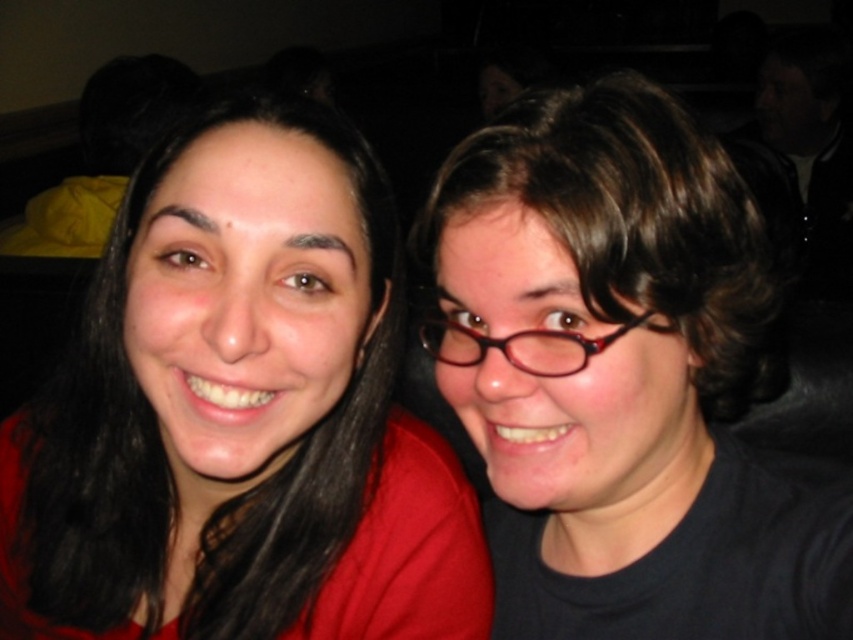
Can you confirm if matte black hair at left is wider than black matte glasses at center?

Yes, matte black hair at left is wider than black matte glasses at center.

This screenshot has width=853, height=640. Identify the location of matte black hair at left. (241, 413).